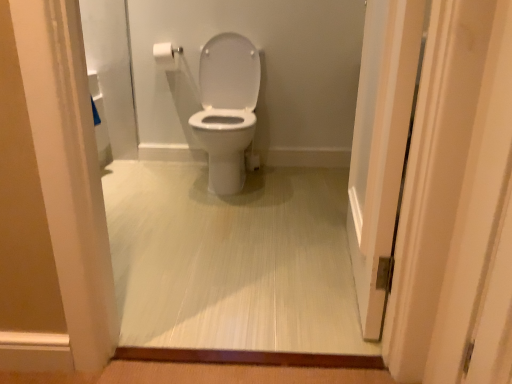
Question: Is white glossy toilet at center surrounding white glossy door at right?

Choices:
 (A) no
 (B) yes

Answer: (A)

Question: From a real-world perspective, is white glossy toilet at center below white glossy door at right?

Choices:
 (A) no
 (B) yes

Answer: (B)

Question: Is white glossy toilet at center thinner than white glossy door at right?

Choices:
 (A) yes
 (B) no

Answer: (B)

Question: From the image's perspective, is white glossy toilet at center under white glossy door at right?

Choices:
 (A) no
 (B) yes

Answer: (B)

Question: Is white glossy toilet at center outside of white glossy door at right?

Choices:
 (A) yes
 (B) no

Answer: (A)

Question: Considering the positions of white glossy toilet at center and white matte toilet paper at upper left in the image, is white glossy toilet at center bigger or smaller than white matte toilet paper at upper left?

Choices:
 (A) big
 (B) small

Answer: (A)

Question: In terms of height, does white glossy toilet at center look taller or shorter compared to white matte toilet paper at upper left?

Choices:
 (A) short
 (B) tall

Answer: (A)

Question: Choose the correct answer: Is white glossy toilet at center inside white matte toilet paper at upper left or outside it?

Choices:
 (A) inside
 (B) outside

Answer: (B)

Question: Considering the positions of white glossy toilet at center and white matte toilet paper at upper left in the image, is white glossy toilet at center wider or thinner than white matte toilet paper at upper left?

Choices:
 (A) thin
 (B) wide

Answer: (B)

Question: Is point (168, 64) positioned closer to the camera than point (367, 71)?

Choices:
 (A) closer
 (B) farther

Answer: (B)

Question: From a real-world perspective, relative to white glossy door at right, is white matte toilet paper at upper left vertically above or below?

Choices:
 (A) above
 (B) below

Answer: (A)

Question: Based on their positions, is white matte toilet paper at upper left located to the left or right of white glossy door at right?

Choices:
 (A) left
 (B) right

Answer: (A)

Question: From the image's perspective, is white matte toilet paper at upper left above or below white glossy door at right?

Choices:
 (A) below
 (B) above

Answer: (B)

Question: Is white glossy door at right spatially inside white glossy toilet at center, or outside of it?

Choices:
 (A) inside
 (B) outside

Answer: (B)

Question: In terms of height, does white glossy door at right look taller or shorter compared to white glossy toilet at center?

Choices:
 (A) tall
 (B) short

Answer: (A)